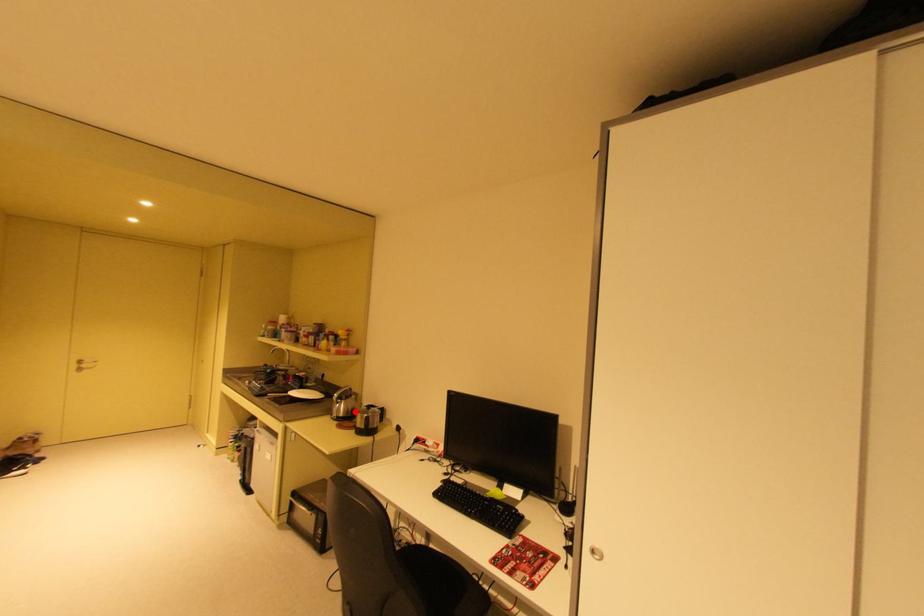
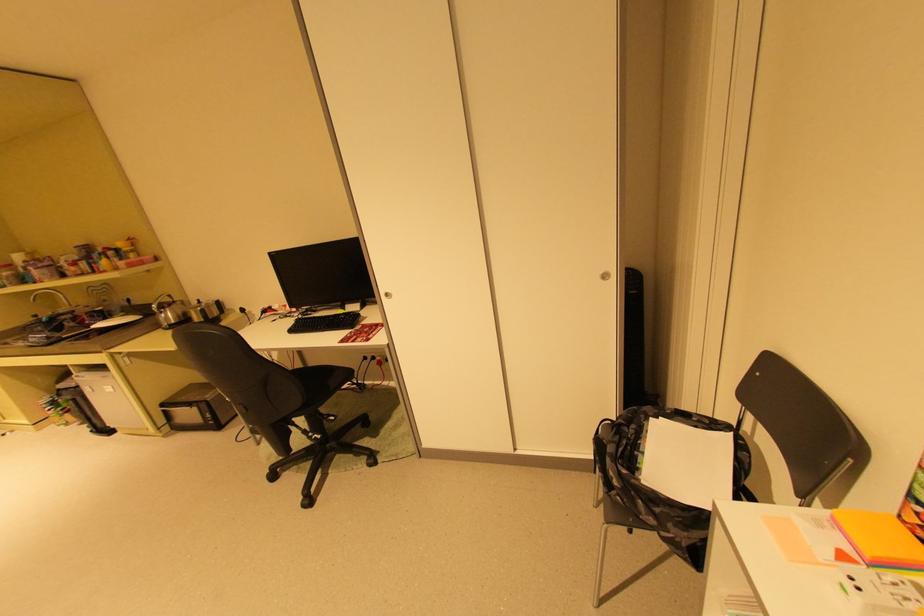
The point at the highlighted location is marked in the first image. Where is the corresponding point in the second image?

(187, 317)